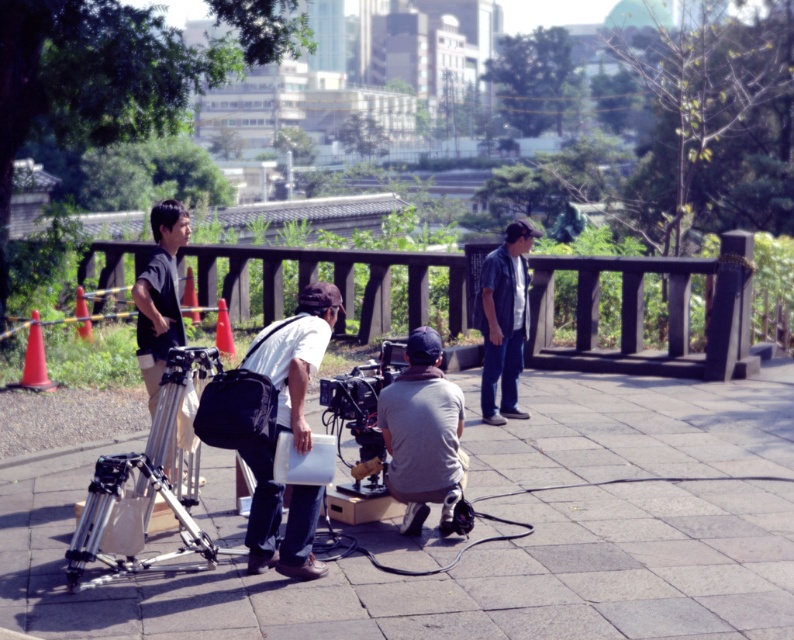
Question: Does brown wooden rail at center have a greater width compared to dark gray fabric shirt at left?

Choices:
 (A) yes
 (B) no

Answer: (A)

Question: Which is nearer to the matte black video camera at center?

Choices:
 (A) white matte shirt at center
 (B) brown wooden rail at center
 (C) dark gray fabric shirt at left

Answer: (A)

Question: Is gray cotton shirt at center smaller than dark gray fabric shirt at left?

Choices:
 (A) no
 (B) yes

Answer: (A)

Question: Which of the following is the farthest from the observer?

Choices:
 (A) 278,339
 (B) 168,198
 (C) 199,246
 (D) 172,564

Answer: (C)

Question: Does brown wooden rail at center appear on the right side of silver metallic tripod at lower left?

Choices:
 (A) yes
 (B) no

Answer: (B)

Question: Based on their relative distances, which object is farther from the white matte shirt at center?

Choices:
 (A) silver metallic tripod at lower left
 (B) gray cotton shirt at center

Answer: (B)